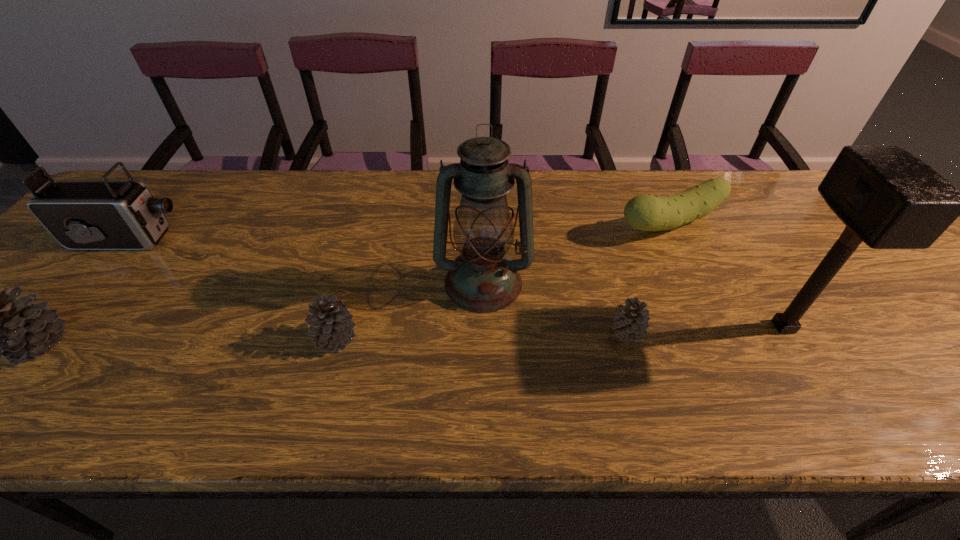
Given the evenly spaced pinecones in the image, where should an extra pinecone be added on the right to preserve the spacing? Please point to a vacant space. Please provide its 2D coordinates. Your answer should be formatted as a tuple, i.e. [(x, y)], where the tuple contains the x and y coordinates of a point satisfying the conditions above.

[(912, 327)]